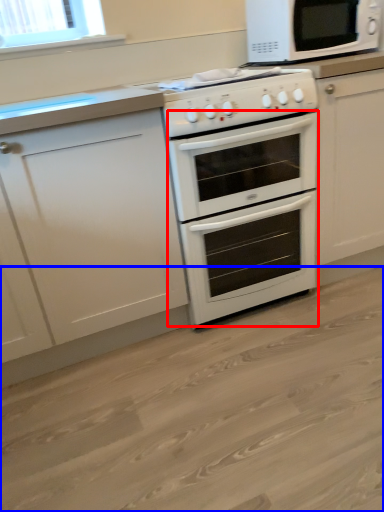
Question: Among these objects, which one is nearest to the camera, oven (highlighted by a red box) or plain (highlighted by a blue box)?

Choices:
 (A) oven
 (B) plain

Answer: (B)